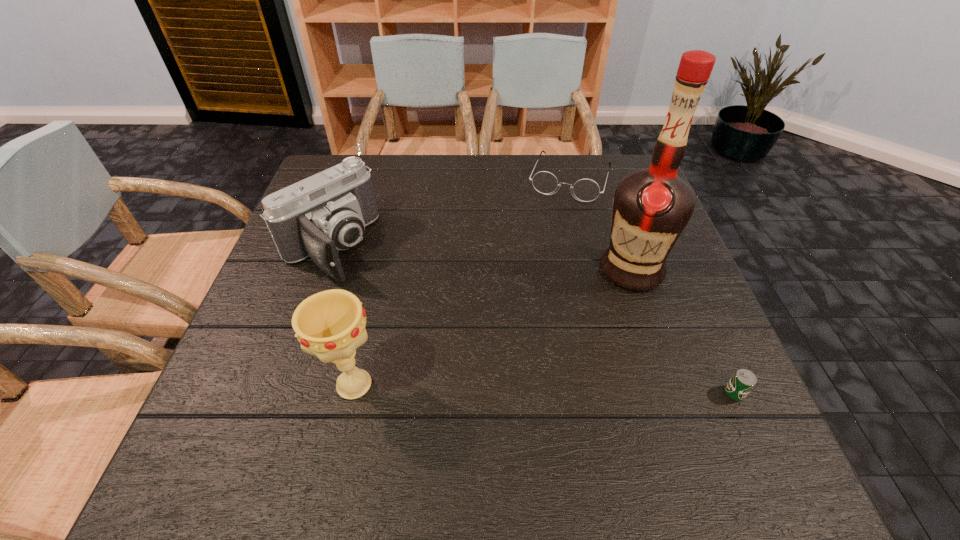
Find the location of a particular element. Image resolution: width=960 pixels, height=540 pixels. blank area at the far right corner is located at coordinates (596, 154).

Image resolution: width=960 pixels, height=540 pixels. What are the coordinates of `free point at the near right corner` in the screenshot? It's located at (702, 399).

The width and height of the screenshot is (960, 540). Identify the location of blank region between the liquor and the fourth tallest object. (600, 224).

I want to click on vacant space that's between the shortest object and the third tallest object, so click(532, 320).

At what (x,y) coordinates should I click in order to perform the action: click on vacant region between the liquor and the chalice. Please return your answer as a coordinate pair (x, y). This screenshot has width=960, height=540. Looking at the image, I should click on (492, 327).

Where is `free space between the spectacles and the liquor`? free space between the spectacles and the liquor is located at coordinates (600, 224).

You are a GUI agent. You are given a task and a screenshot of the screen. Output one action in this format:
    pyautogui.click(x=<x>, y=<y>)
    Task: Click on the vacant space that's between the shortest object and the camera
    The height and width of the screenshot is (540, 960).
    Given the screenshot: What is the action you would take?
    pyautogui.click(x=532, y=320)

Identify the location of free space between the fourth tallest object and the tallest object. The image size is (960, 540). (600, 224).

Find the location of `object that can be found as the fourth closest to the farthest object`. object that can be found as the fourth closest to the farthest object is located at coordinates (330, 324).

Where is `object that is the nearest to the camera`? The height and width of the screenshot is (540, 960). object that is the nearest to the camera is located at coordinates point(330,324).